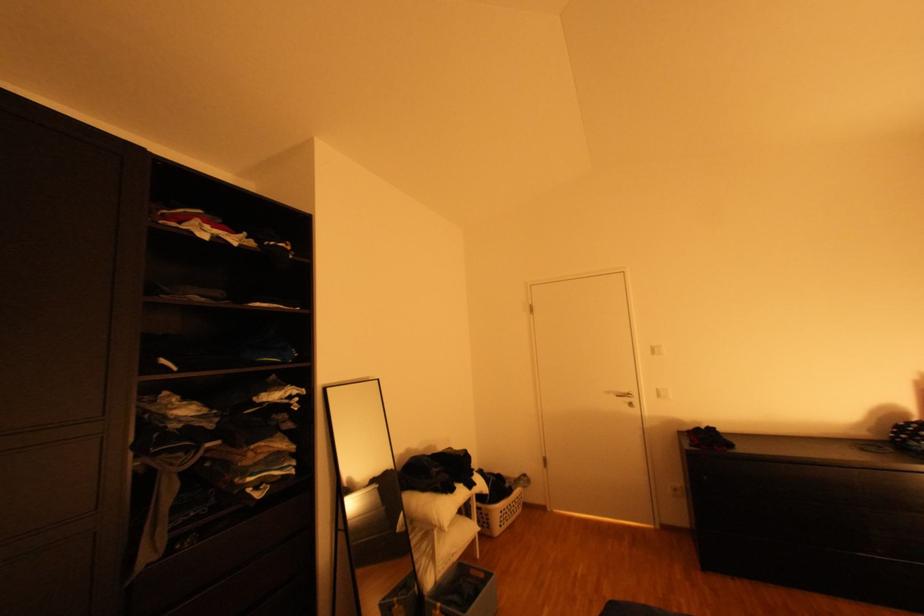
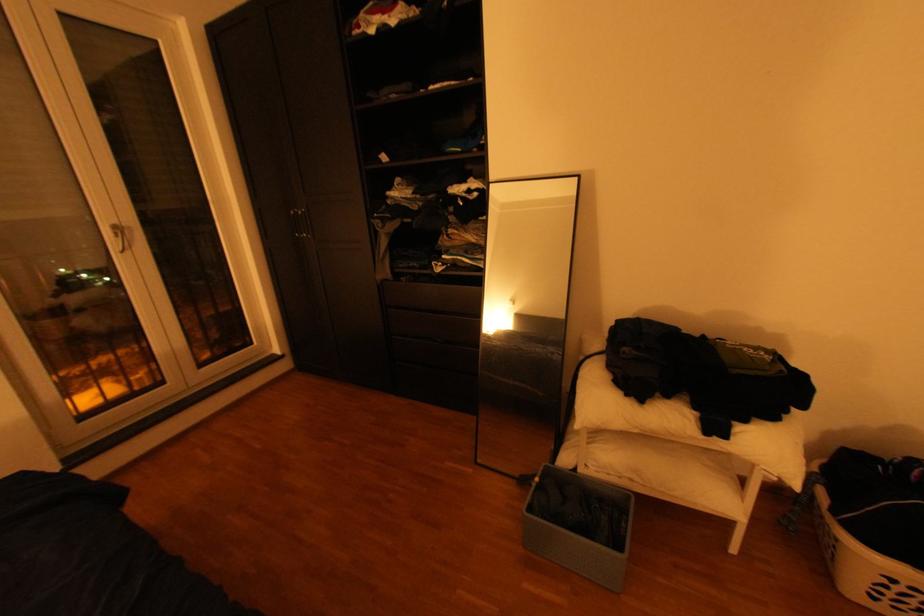
Where in the second image is the point corresponding to (x=484, y=484) from the first image?

(735, 436)